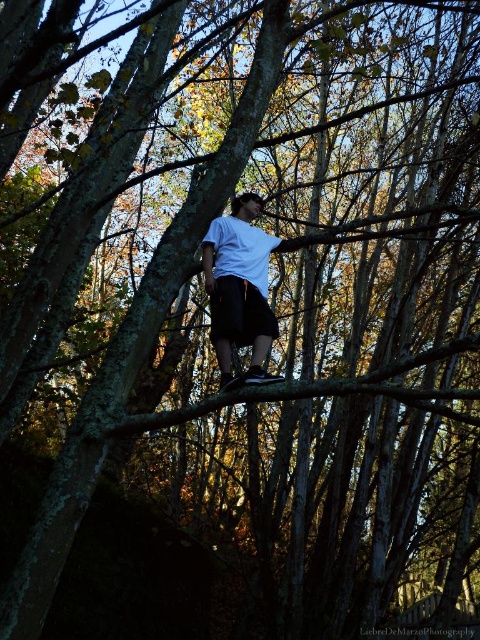
You are a photographer trying to capture a closeup of the white matte shirt at center and the black matte shorts at center. Which clothing item will appear wider in the photo?

The white matte shirt at center will appear wider in the photo since its width surpasses that of the black matte shorts at center.